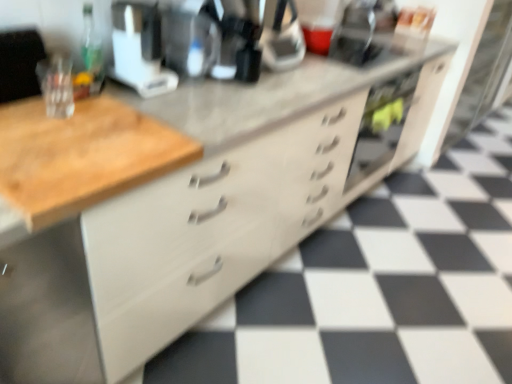
Question: From a real-world perspective, is green glass bottle at upper left positioned under white plastic coffee maker at upper center based on gravity?

Choices:
 (A) no
 (B) yes

Answer: (B)

Question: From a real-world perspective, is green glass bottle at upper left located higher than white plastic coffee maker at upper center?

Choices:
 (A) yes
 (B) no

Answer: (B)

Question: Does green glass bottle at upper left turn towards white plastic coffee maker at upper center?

Choices:
 (A) no
 (B) yes

Answer: (A)

Question: Is green glass bottle at upper left placed right next to white plastic coffee maker at upper center?

Choices:
 (A) no
 (B) yes

Answer: (A)

Question: Is green glass bottle at upper left positioned beyond the bounds of white plastic coffee maker at upper center?

Choices:
 (A) no
 (B) yes

Answer: (B)

Question: Considering the relative sizes of green glass bottle at upper left and white plastic coffee maker at upper center in the image provided, is green glass bottle at upper left bigger than white plastic coffee maker at upper center?

Choices:
 (A) yes
 (B) no

Answer: (B)

Question: Is white plastic coffee maker at upper center oriented away from green glass bottle at upper left?

Choices:
 (A) yes
 (B) no

Answer: (B)

Question: Can you confirm if white plastic coffee maker at upper center is thinner than green glass bottle at upper left?

Choices:
 (A) no
 (B) yes

Answer: (A)

Question: From the image's perspective, is white plastic coffee maker at upper center beneath green glass bottle at upper left?

Choices:
 (A) yes
 (B) no

Answer: (B)

Question: Is green glass bottle at upper left a part of white plastic coffee maker at upper center?

Choices:
 (A) yes
 (B) no

Answer: (B)

Question: Does white plastic coffee maker at upper center have a greater width compared to green glass bottle at upper left?

Choices:
 (A) yes
 (B) no

Answer: (A)

Question: Is white plastic coffee maker at upper center positioned beyond the bounds of green glass bottle at upper left?

Choices:
 (A) no
 (B) yes

Answer: (B)

Question: From a real-world perspective, is black plastic coffee machine at center positioned over green glass bottle at upper left based on gravity?

Choices:
 (A) yes
 (B) no

Answer: (A)